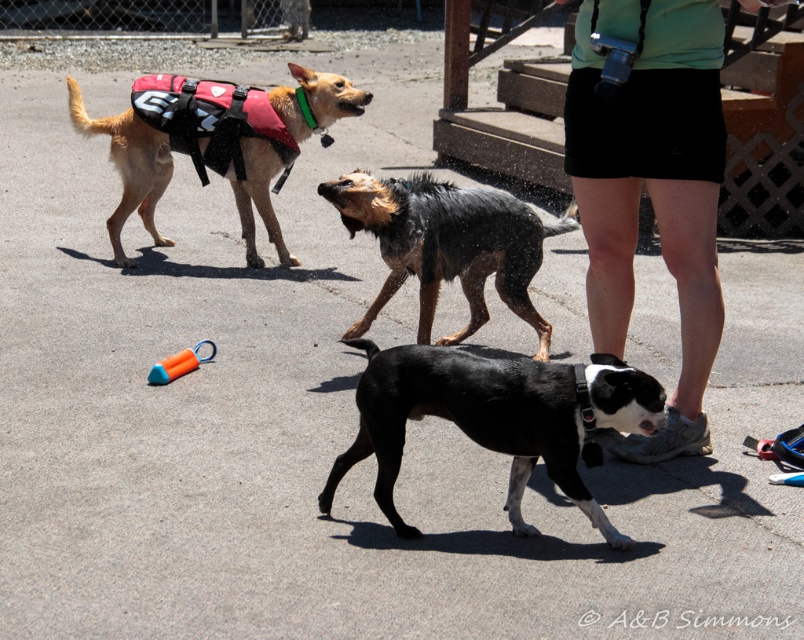
Question: Which object appears farthest from the camera in this image?

Choices:
 (A) black matte dog at center
 (B) orange rubber toy at center
 (C) red synthetic life jacket at upper left

Answer: (C)

Question: Which of the following is the farthest from the observer?

Choices:
 (A) (368, 401)
 (B) (380, 193)

Answer: (B)

Question: Is black matte dog at center bigger than red life vest at upper left?

Choices:
 (A) yes
 (B) no

Answer: (B)

Question: Can you confirm if black matte dog at center is bigger than red life vest at upper left?

Choices:
 (A) no
 (B) yes

Answer: (A)

Question: Which point is farther to the camera?

Choices:
 (A) orange rubber toy at center
 (B) green fabric shirt at upper center
 (C) black matte dog at center
 (D) shiny black fur at center

Answer: (D)

Question: Does red life vest at upper left have a lesser width compared to orange rubber toy at center?

Choices:
 (A) yes
 (B) no

Answer: (B)